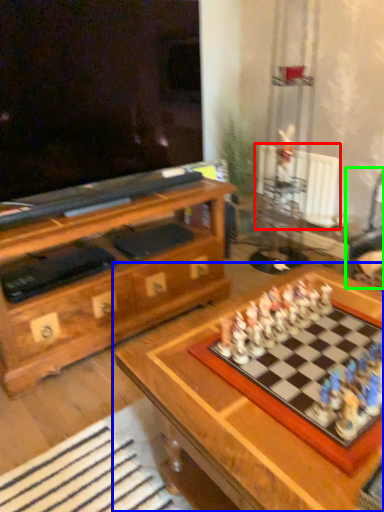
Question: Estimate the real-world distances between objects in this image. Which object is farther from radiator (highlighted by a red box), table (highlighted by a blue box) or swivel chair (highlighted by a green box)?

Choices:
 (A) table
 (B) swivel chair

Answer: (A)